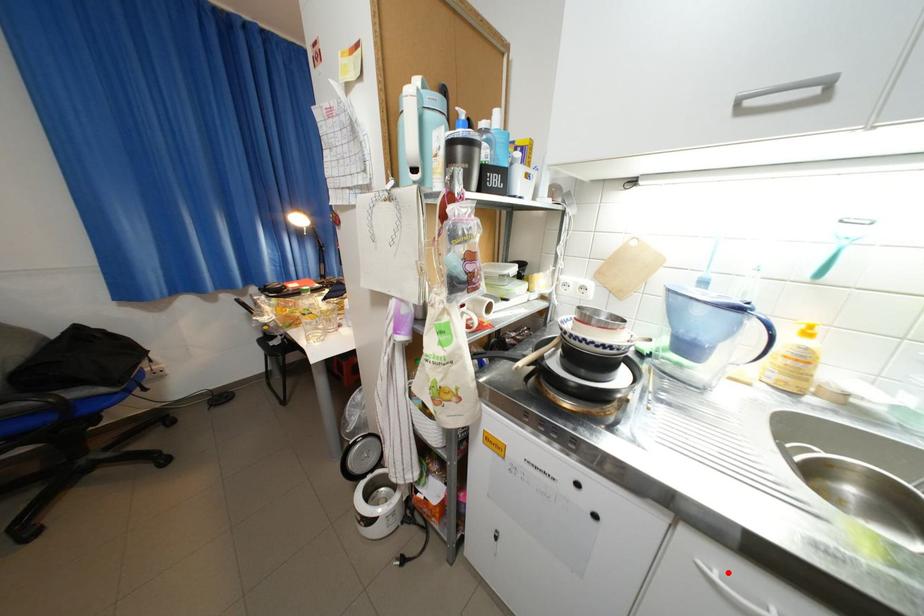
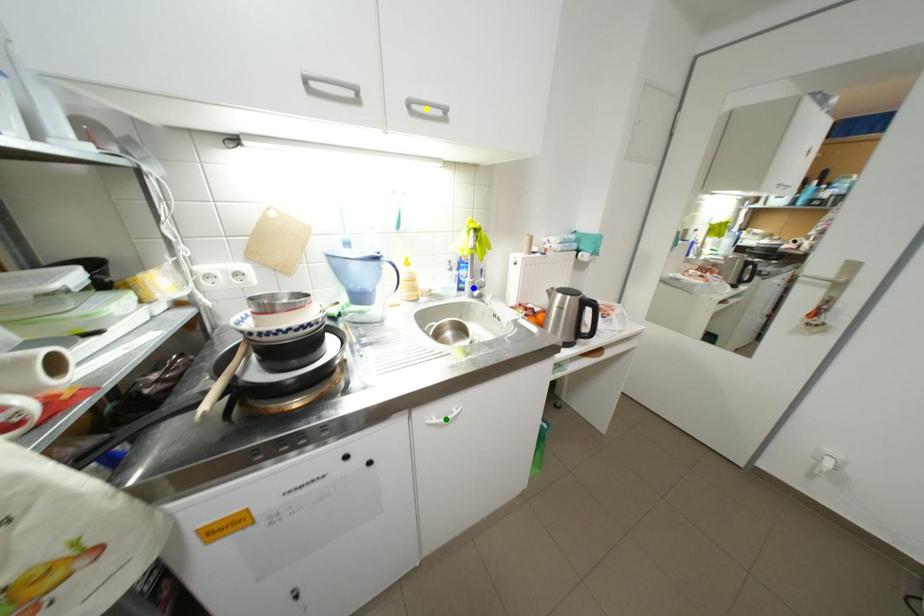
Question: I am providing you with two images of the same scene from different viewpoints. A red point is marked on the first image. You are given multiple points on the second image. Which point in image 2 represents the same 3d spot as the red point in image 1?

Choices:
 (A) blue point
 (B) green point
 (C) yellow point

Answer: (B)